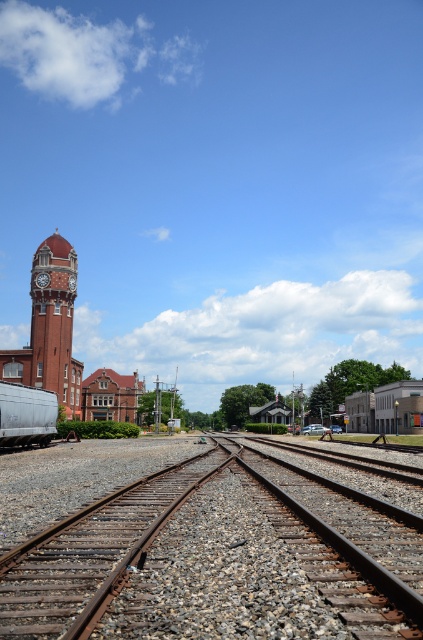
Is point (200, 541) positioned in front of point (68, 401)?

That is True.

What do you see at coordinates (206, 554) in the screenshot? This screenshot has width=423, height=640. I see `rusty metal train tracks at center` at bounding box center [206, 554].

Image resolution: width=423 pixels, height=640 pixels. I want to click on rusty metal train tracks at center, so click(x=206, y=554).

Is matte brick clock tower at left wider than silver metallic train car at lower left?

Yes.

Can you confirm if matte brick clock tower at left is taller than silver metallic train car at lower left?

Yes.

Describe the element at coordinates (54, 323) in the screenshot. I see `matte brick clock tower at left` at that location.

Image resolution: width=423 pixels, height=640 pixels. I want to click on matte brick clock tower at left, so click(x=54, y=323).

Looking at this image, can you confirm if rusty metal train tracks at center is taller than silver metallic train car at lower left?

Incorrect, rusty metal train tracks at center's height is not larger of silver metallic train car at lower left's.

Which is below, rusty metal train tracks at center or silver metallic train car at lower left?

rusty metal train tracks at center is below.

What do you see at coordinates (206, 554) in the screenshot? I see `rusty metal train tracks at center` at bounding box center [206, 554].

Image resolution: width=423 pixels, height=640 pixels. In order to click on rusty metal train tracks at center in this screenshot , I will do `click(206, 554)`.